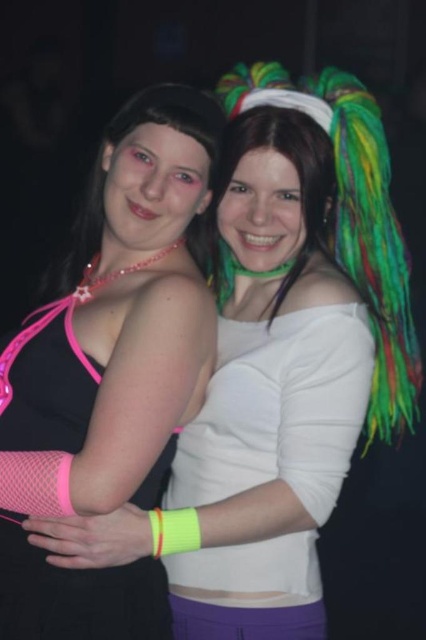
Question: Which point appears closest to the camera in this image?

Choices:
 (A) (51, 403)
 (B) (37, 481)
 (C) (310, 230)
 (D) (233, 378)

Answer: (B)

Question: Observing the image, what is the correct spatial positioning of pink mesh dress at center in reference to matte black hair at left?

Choices:
 (A) above
 (B) below

Answer: (B)

Question: Does matte black tank top at center have a smaller size compared to matte white shirt at center?

Choices:
 (A) no
 (B) yes

Answer: (A)

Question: Which point is farther to the camera?

Choices:
 (A) (115, 259)
 (B) (262, 364)

Answer: (A)

Question: Considering the relative positions of matte black tank top at center and matte white shirt at center in the image provided, where is matte black tank top at center located with respect to matte white shirt at center?

Choices:
 (A) left
 (B) right

Answer: (A)

Question: Which is nearer to the matte black tank top at center?

Choices:
 (A) matte black hair at left
 (B) pink mesh dress at center

Answer: (B)